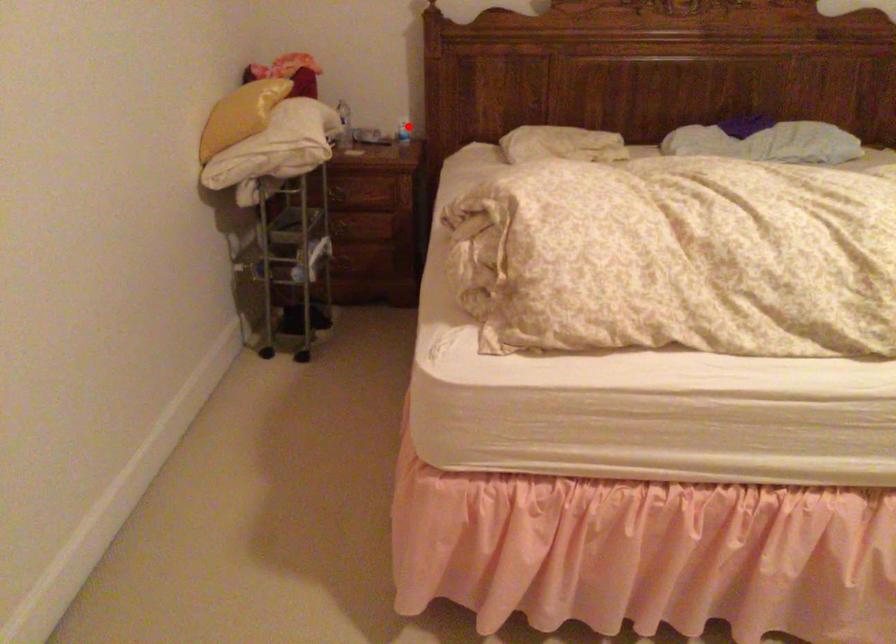
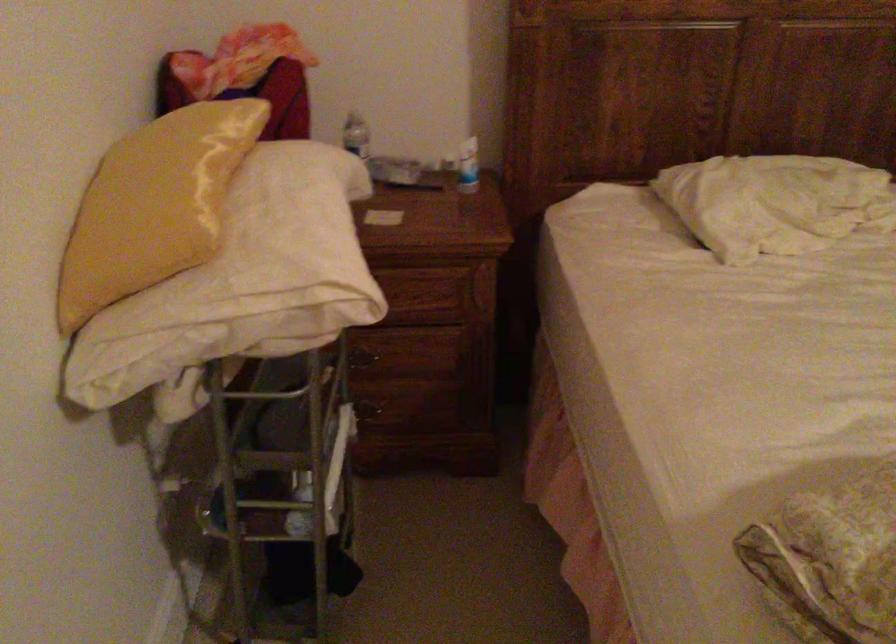
Locate, in the second image, the point that corresponds to the highlighted location in the first image.

(468, 166)